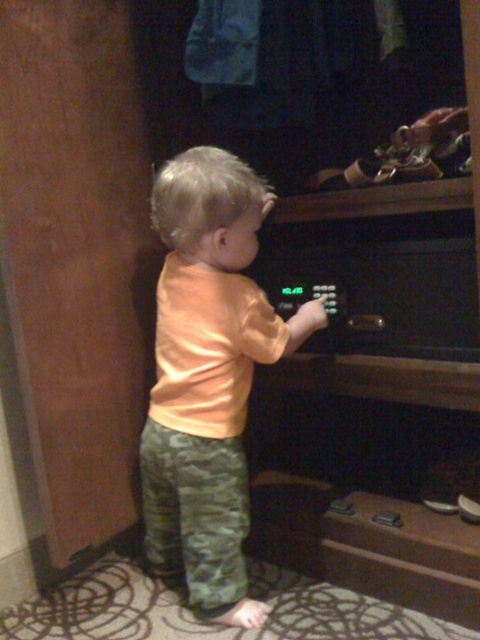
Question: Does orange matte shirt at center appear under green digital display at center?

Choices:
 (A) yes
 (B) no

Answer: (A)

Question: Does orange matte shirt at center come behind green digital display at center?

Choices:
 (A) yes
 (B) no

Answer: (B)

Question: Which of the following is the closest to the observer?

Choices:
 (A) green digital display at center
 (B) orange matte shirt at center

Answer: (B)

Question: Can you confirm if orange matte shirt at center is smaller than green digital display at center?

Choices:
 (A) yes
 (B) no

Answer: (B)

Question: Among these points, which one is farthest from the camera?

Choices:
 (A) (285, 316)
 (B) (288, 337)

Answer: (A)